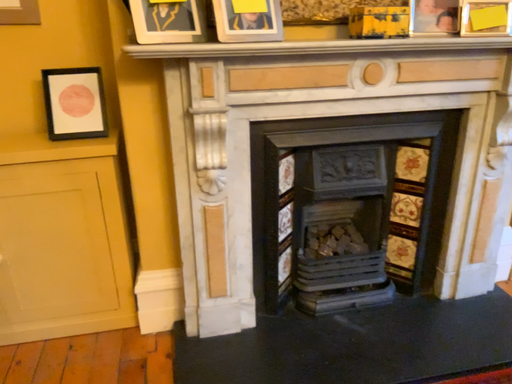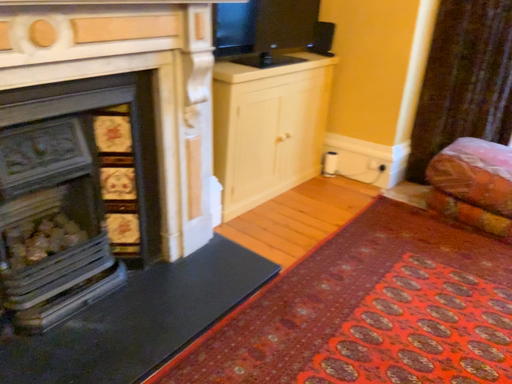
Question: How did the camera likely rotate when shooting the video?

Choices:
 (A) rotated left
 (B) rotated right

Answer: (B)